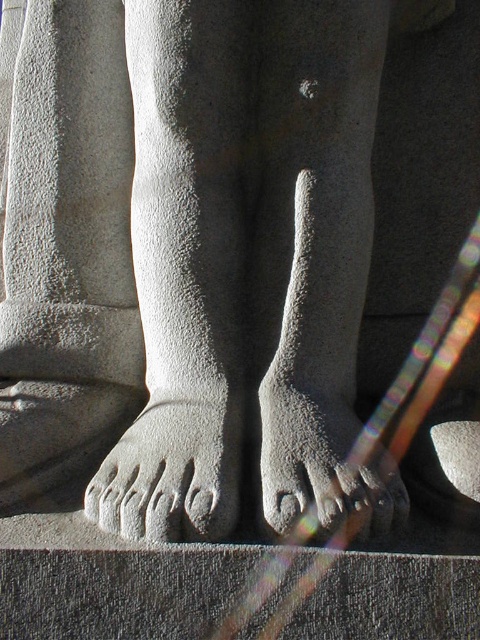
You are an art student analyzing the placement of the gray stone foot at lower center in the sculpture. What are the coordinates of this foot in the image?

The coordinates of the gray stone foot at lower center are at point (171, 474).